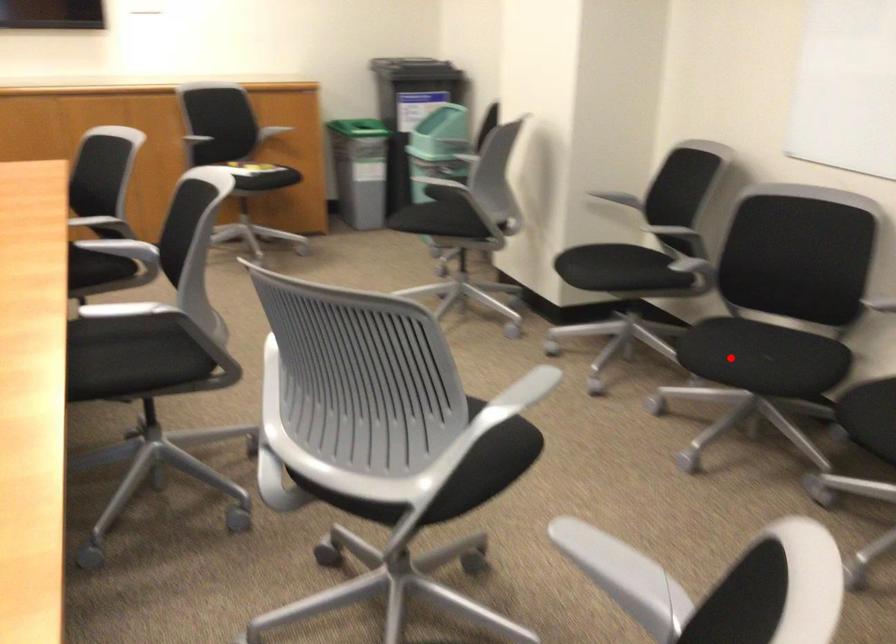
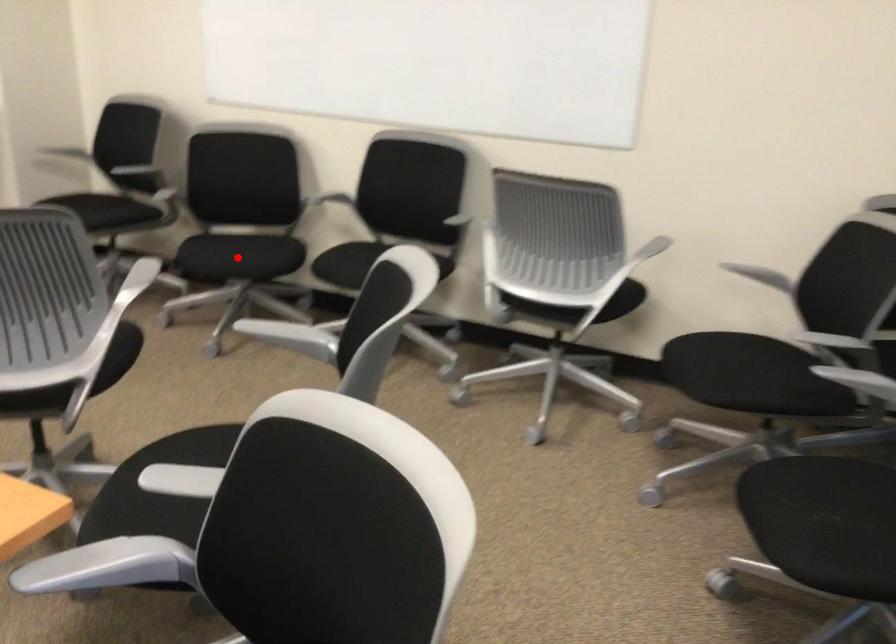
I am providing you with two images of the same scene from different viewpoints. A red point is marked on the first image and another point is marked on the second image. Is the marked point in image1 the same physical position as the marked point in image2?

Yes